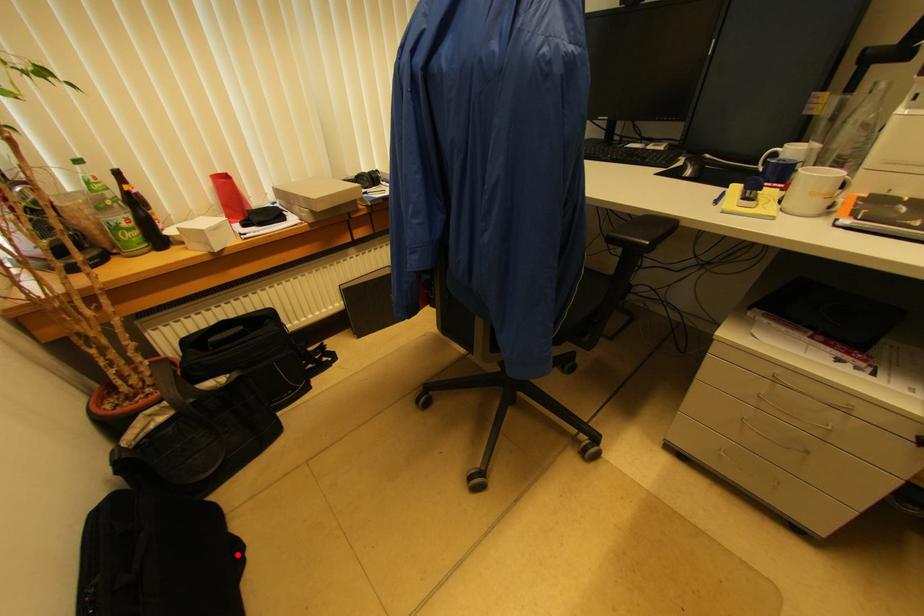
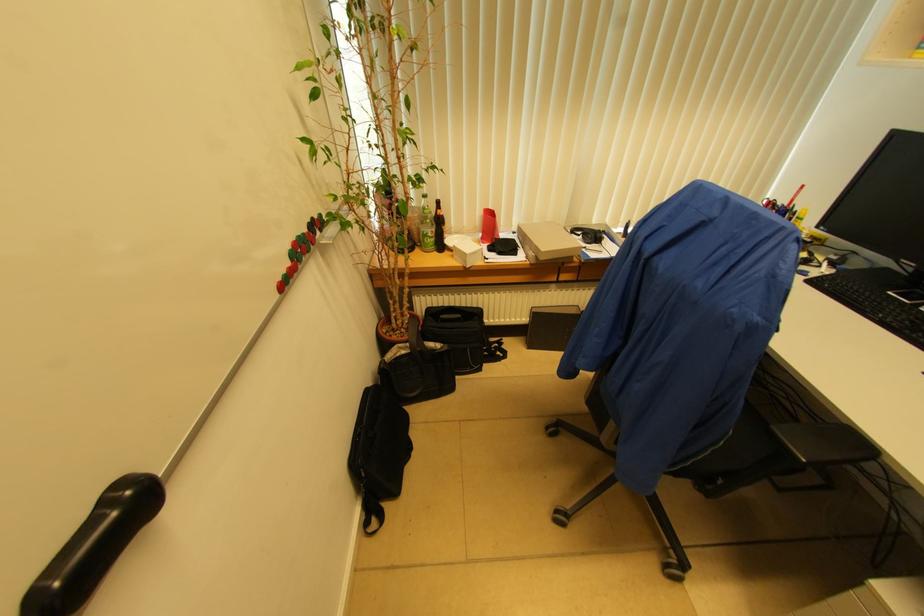
Find the pixel in the second image that matches the highlighted location in the first image.

(409, 451)